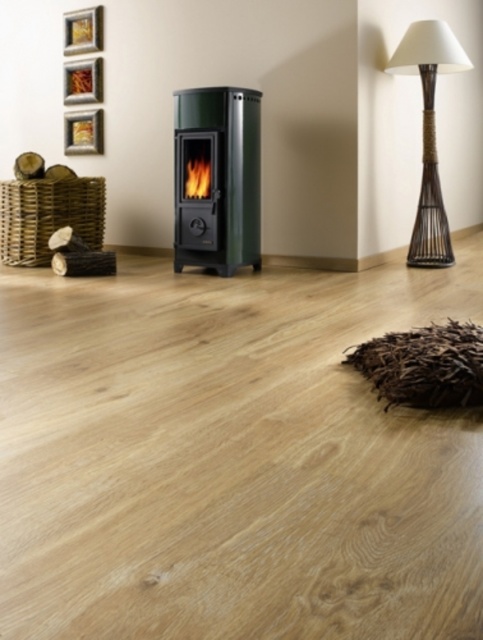
Question: Which is farther from the metallic gold picture frame at upper left?

Choices:
 (A) woven bamboo lamp at upper right
 (B) green matte fireplace at center
 (C) wooden picture frame at upper left
 (D) gold metallic picture frame at upper left

Answer: (A)

Question: Is gold metallic picture frame at upper left further to camera compared to metallic gold picture frame at upper left?

Choices:
 (A) no
 (B) yes

Answer: (B)

Question: Which of the following is the closest to the observer?

Choices:
 (A) gold metallic picture frame at upper left
 (B) metallic gold picture frame at upper left

Answer: (B)

Question: Can you confirm if gold metallic picture frame at upper left is thinner than wooden picture frame at upper left?

Choices:
 (A) no
 (B) yes

Answer: (A)

Question: Which object appears closest to the camera in this image?

Choices:
 (A) green matte fireplace at center
 (B) gold metallic picture frame at upper left
 (C) metallic gold picture frame at upper left

Answer: (A)

Question: From the image, what is the correct spatial relationship of wooden picture frame at upper left in relation to metallic gold picture frame at upper left?

Choices:
 (A) above
 (B) below

Answer: (A)